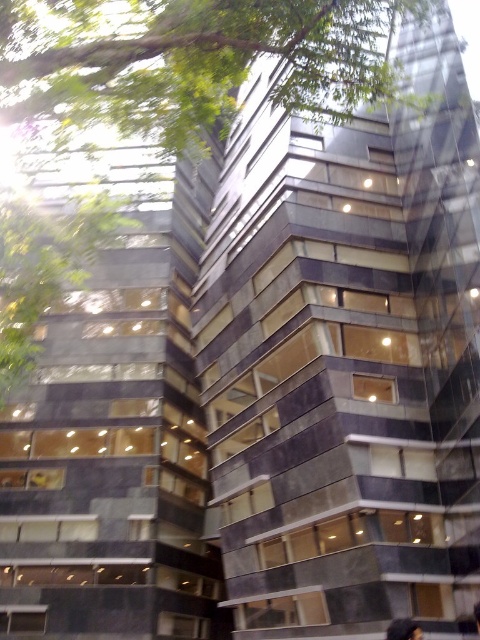
Looking at this image, you are an architect analyzing the building facade. You notice the green leafy tree at upper left and the dark hair at upper center. Which object has a greater width?

The green leafy tree at upper left has a greater width than the dark hair at upper center.

You are standing in front of the modern building and want to take a photo of the entire structure without any obstructions. The green leafy tree at upper left is represented by point (189, 61). Which object might block your view of the building?

The green leafy tree at upper left represented by point (189, 61) is partially obscuring the view of the building, so it might block your view.